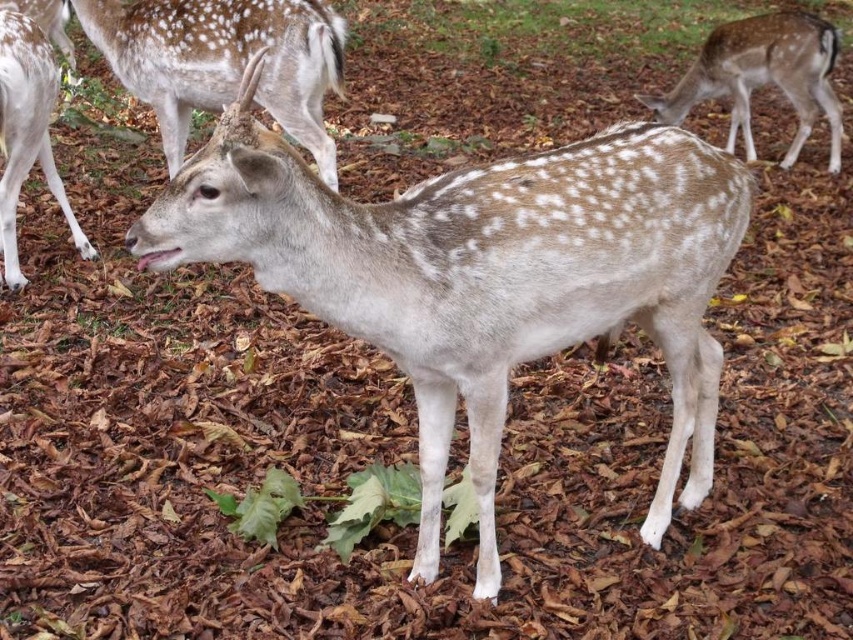
You are a wildlife photographer aiming to capture a photo of both the speckled fur deer at upper right and the spotted fur at left. Based on their positions, which deer would require you to zoom in more to include both in the frame?

The spotted fur at left would require more zooming in because the speckled fur deer at upper right is wider, meaning the spotted fur at left is smaller in size and thus needs a closer focus to be captured clearly alongside the wider deer.

You are a wildlife photographer trying to capture a photo of the speckled fur deer at upper right and the spotted fur at left. Since you want both in the frame, which direction should you move your camera to include both?

To include both the speckled fur deer at upper right and the spotted fur at left in your photo, you should move your camera to the left, as the speckled fur deer at upper right is positioned to the right of the spotted fur at left.